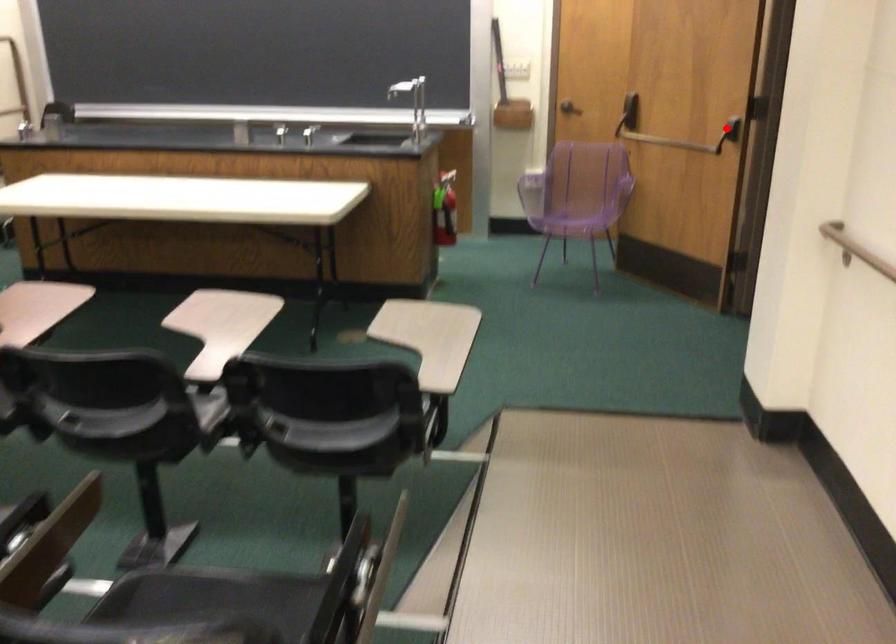
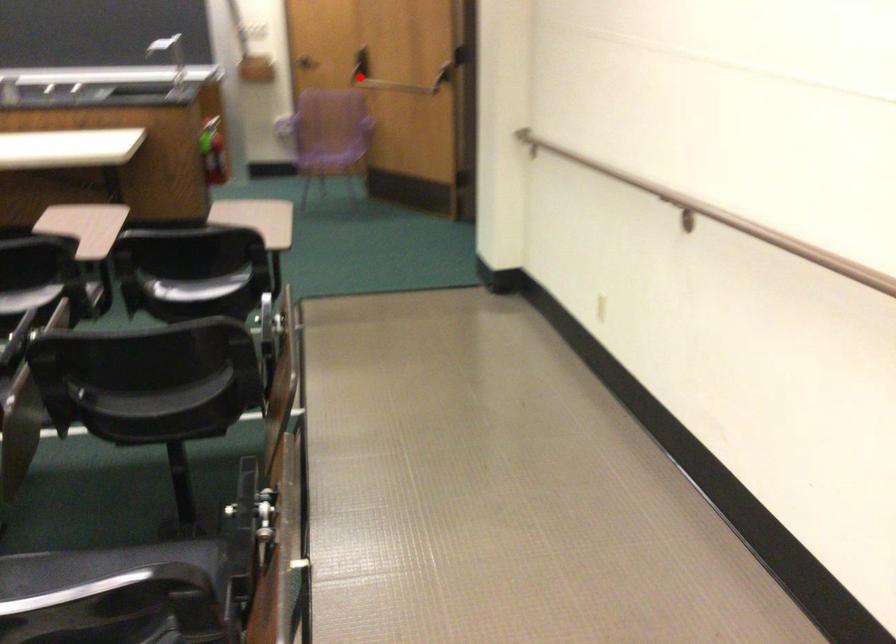
I am providing you with two images of the same scene from different viewpoints. A red point is marked on the first image and another point is marked on the second image. Do the highlighted points in image1 and image2 indicate the same real-world spot?

No